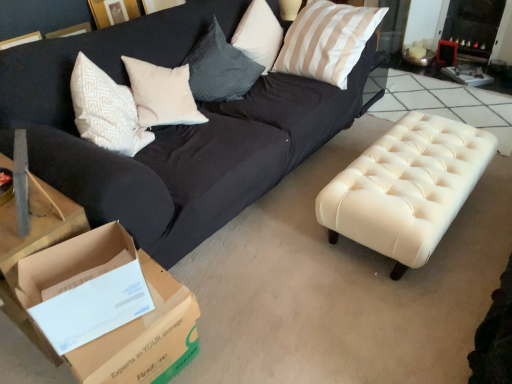
Question: Is brown cardboard box at lower left in front of or behind silky beige pillow at upper right in the image?

Choices:
 (A) behind
 (B) front

Answer: (B)

Question: Is brown cardboard box at lower left inside or outside of silky beige pillow at upper right?

Choices:
 (A) inside
 (B) outside

Answer: (B)

Question: Which is farther from the silky beige pillow at upper right?

Choices:
 (A) creamy leather ottoman at center
 (B) brown cardboard box at lower left

Answer: (B)

Question: Which of these objects is positioned closest to the creamy leather ottoman at center?

Choices:
 (A) brown cardboard box at lower left
 (B) silky beige pillow at upper right

Answer: (B)